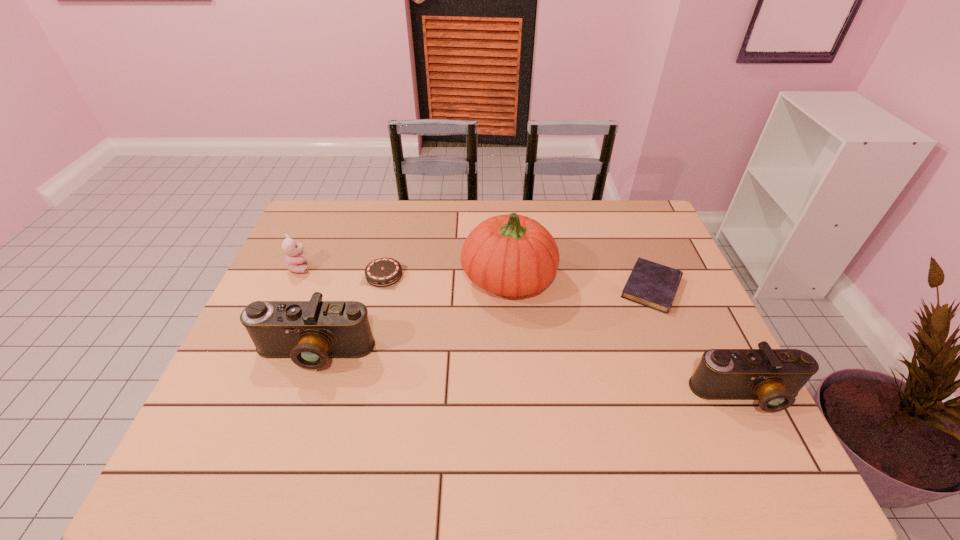
At what (x,y) coordinates should I click in order to perform the action: click on free space between the right camera and the teddy bear. Please return your answer as a coordinate pair (x, y). This screenshot has width=960, height=540. Looking at the image, I should click on (523, 331).

The height and width of the screenshot is (540, 960). Find the location of `vacant area that lies between the shorter camera and the tallest object`. vacant area that lies between the shorter camera and the tallest object is located at coordinates (627, 336).

In order to click on vacant area that lies between the left camera and the right camera in this screenshot , I will do `click(530, 374)`.

Identify which object is the second closest to the third object from right to left. Please provide its 2D coordinates. Your answer should be formatted as a tuple, i.e. [(x, y)], where the tuple contains the x and y coordinates of a point satisfying the conditions above.

[(650, 284)]

Image resolution: width=960 pixels, height=540 pixels. Find the location of `the second closest object relative to the shorter camera`. the second closest object relative to the shorter camera is located at coordinates (512, 255).

Where is `free point that satisfies the following two spatial constraints: 1. on the front side of the chocolate cake; 2. on the left side of the tallest object`? This screenshot has height=540, width=960. free point that satisfies the following two spatial constraints: 1. on the front side of the chocolate cake; 2. on the left side of the tallest object is located at coordinates (383, 279).

The image size is (960, 540). I want to click on vacant region that satisfies the following two spatial constraints: 1. at the face of the diary; 2. on the right side of the teddy bear, so click(291, 288).

Find the location of a particular element. This screenshot has width=960, height=540. free space in the image that satisfies the following two spatial constraints: 1. on the front side of the fifth tallest object; 2. on the left side of the third object from right to left is located at coordinates (383, 279).

Locate an element on the screen. vacant area that satisfies the following two spatial constraints: 1. at the face of the teddy bear; 2. on the left side of the second shortest object is located at coordinates (297, 275).

The height and width of the screenshot is (540, 960). Identify the location of free space that satisfies the following two spatial constraints: 1. at the face of the teddy bear; 2. on the right side of the fourth object from left to right. (295, 279).